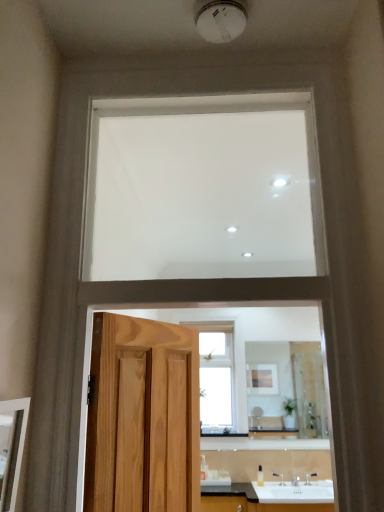
The height and width of the screenshot is (512, 384). Find the location of `clear glass window at center, acting as the second window starting from the front`. clear glass window at center, acting as the second window starting from the front is located at coordinates (216, 375).

Describe the element at coordinates (286, 388) in the screenshot. I see `clear glass mirror at center, which is counted as the 2th mirror, starting from the front` at that location.

Describe the element at coordinates (11, 448) in the screenshot. This screenshot has width=384, height=512. I see `matte wooden mirror at left, placed as the 2th mirror when sorted from bottom to top` at that location.

This screenshot has width=384, height=512. What do you see at coordinates (295, 492) in the screenshot?
I see `white glossy sink at lower center` at bounding box center [295, 492].

At what (x,y) coordinates should I click in order to perform the action: click on clear glass window at center, positioned as the 1th window in back-to-front order. Please return your answer as a coordinate pair (x, y). Image resolution: width=384 pixels, height=512 pixels. Looking at the image, I should click on (216, 375).

From a real-world perspective, is white glossy sink at lower center physically located above or below matte wooden mirror at left, which is the first mirror in top-to-bottom order?

Clearly, from a real-world perspective, white glossy sink at lower center is below matte wooden mirror at left, which is the first mirror in top-to-bottom order.

Is white glossy sink at lower center oriented away from matte wooden mirror at left, which is the first mirror in top-to-bottom order?

No, matte wooden mirror at left, which is the first mirror in top-to-bottom order, is not at the back of white glossy sink at lower center.

Would you say white glossy sink at lower center is inside or outside matte wooden mirror at left, placed as the 2th mirror when sorted from bottom to top?

white glossy sink at lower center lies outside matte wooden mirror at left, placed as the 2th mirror when sorted from bottom to top.

How far apart are white glossy sink at lower center and matte wooden mirror at left, the first mirror from the front?

2.89 meters.

Between clear glass window at center, arranged as the 2th window when viewed from the top, and clear glass mirror at center, the 2th mirror viewed from the left, which one has less height?

With less height is clear glass mirror at center, the 2th mirror viewed from the left.

Is there a large distance between clear glass window at center, positioned as the 1th window in back-to-front order, and clear glass mirror at center, which is counted as the 2th mirror, starting from the front?

clear glass window at center, positioned as the 1th window in back-to-front order, is actually quite close to clear glass mirror at center, which is counted as the 2th mirror, starting from the front.

In the scene shown: Is clear glass window at center, positioned as the 1th window in back-to-front order, surrounding clear glass mirror at center, the 2th mirror viewed from the left?

No, clear glass mirror at center, the 2th mirror viewed from the left, is located outside of clear glass window at center, positioned as the 1th window in back-to-front order.

Can you confirm if matte wooden mirror at left, the 2th mirror in the back-to-front sequence, is shorter than clear glass window at center, arranged as the 2th window when viewed from the top?

Yes.

From a real-world perspective, who is located higher, matte wooden mirror at left, which is the 1th mirror in left-to-right order, or clear glass window at center, arranged as the 2th window when viewed from the top?

clear glass window at center, arranged as the 2th window when viewed from the top, from a real-world perspective.

The height and width of the screenshot is (512, 384). In order to click on mirror in front of the clear glass window at center, positioned as the 1th window in back-to-front order in this screenshot , I will do `click(11, 448)`.

In the scene shown: Is matte wooden mirror at left, the 2th mirror in the back-to-front sequence, smaller than clear glass window at center, arranged as the 2th window when viewed from the top?

Indeed, matte wooden mirror at left, the 2th mirror in the back-to-front sequence, has a smaller size compared to clear glass window at center, arranged as the 2th window when viewed from the top.

Is matte wooden mirror at left, the first mirror from the front, located outside white glossy sink at lower center?

Yes, matte wooden mirror at left, the first mirror from the front, is not within white glossy sink at lower center.

In order to click on mirror that is on the left side of white glossy sink at lower center in this screenshot , I will do `click(11, 448)`.

Which of these two, matte wooden mirror at left, which is the 1th mirror in left-to-right order, or white glossy sink at lower center, stands shorter?

white glossy sink at lower center is shorter.

What's the angular difference between matte wooden mirror at left, the 2th mirror in the back-to-front sequence, and white glossy sink at lower center's facing directions?

They differ by 88.6 degrees in their facing directions.

Considering the positions of objects clear glass window at center, acting as the second window starting from the front, and matte wooden mirror at left, placed as the 2th mirror when sorted from bottom to top, in the image provided, who is more to the left, clear glass window at center, acting as the second window starting from the front, or matte wooden mirror at left, placed as the 2th mirror when sorted from bottom to top,?

Positioned to the left is matte wooden mirror at left, placed as the 2th mirror when sorted from bottom to top.

Is clear glass window at center, arranged as the 2th window when viewed from the top, bigger than matte wooden mirror at left, which is the 1th mirror in left-to-right order?

Yes.

From a real-world perspective, who is located lower, clear glass window at center, positioned as the 1th window in back-to-front order, or matte wooden mirror at left, which is the 1th mirror in left-to-right order?

matte wooden mirror at left, which is the 1th mirror in left-to-right order.

Looking at this image, considering the positions of objects white matte window at upper center, which ranks as the second window in back-to-front order, and clear glass window at center, arranged as the 2th window when viewed from the top, in the image provided, who is behind, white matte window at upper center, which ranks as the second window in back-to-front order, or clear glass window at center, arranged as the 2th window when viewed from the top,?

clear glass window at center, arranged as the 2th window when viewed from the top, is more distant.

Is point (205, 178) positioned behind point (226, 347)?

No.

Would you say white matte window at upper center, which ranks as the second window in back-to-front order, is inside or outside clear glass window at center, acting as the second window starting from the front?

white matte window at upper center, which ranks as the second window in back-to-front order, is not inside clear glass window at center, acting as the second window starting from the front, it's outside.

Is clear glass window at center, acting as the second window starting from the front, outside of white glossy sink at lower center?

That's correct, clear glass window at center, acting as the second window starting from the front, is outside of white glossy sink at lower center.

Measure the distance from clear glass window at center, arranged as the 2th window when viewed from the top, to white glossy sink at lower center.

clear glass window at center, arranged as the 2th window when viewed from the top, and white glossy sink at lower center are 33.57 inches apart from each other.

Is point (210, 411) less distant than point (315, 494)?

No, it is behind (315, 494).

The image size is (384, 512). I want to click on mirror on the left side of white glossy sink at lower center, so click(x=11, y=448).

Identify the location of mirror lying on the right of clear glass window at center, positioned as the 1th window in back-to-front order. The height and width of the screenshot is (512, 384). (286, 388).

Estimate the real-world distances between objects in this image. Which object is further from matte wooden mirror at left, marked as the second mirror in a right-to-left arrangement, clear glass window at center, arranged as the 2th window when viewed from the top, or white matte window at upper center, the first window in the top-to-bottom sequence?

Among the two, clear glass window at center, arranged as the 2th window when viewed from the top, is located further to matte wooden mirror at left, marked as the second mirror in a right-to-left arrangement.

Based on their spatial positions, is matte wooden mirror at left, which is the 1th mirror in left-to-right order, or white glossy sink at lower center closer to clear glass window at center, arranged as the 2th window when viewed from the top?

Based on the image, white glossy sink at lower center appears to be nearer to clear glass window at center, arranged as the 2th window when viewed from the top.

Which object lies further to the anchor point matte wooden mirror at left, the first mirror from the front, white matte window at upper center, the first window in the top-to-bottom sequence, or clear glass window at center, arranged as the 2th window when viewed from the top?

clear glass window at center, arranged as the 2th window when viewed from the top, is positioned further to the anchor matte wooden mirror at left, the first mirror from the front.

From the image, which object appears to be nearer to white glossy sink at lower center, white matte window at upper center, the first window in the top-to-bottom sequence, or clear glass window at center, the 1th window ordered from the bottom?

clear glass window at center, the 1th window ordered from the bottom, is closer to white glossy sink at lower center.

Looking at the image, which one is located further to clear glass window at center, positioned as the 1th window in back-to-front order, matte wooden mirror at left, the 2th mirror in the back-to-front sequence, or white matte window at upper center, which ranks as the second window in back-to-front order?

The object further to clear glass window at center, positioned as the 1th window in back-to-front order, is matte wooden mirror at left, the 2th mirror in the back-to-front sequence.

From the image, which object appears to be farther from matte wooden mirror at left, the first mirror from the front, clear glass mirror at center, the 2th mirror positioned from the top, or white glossy sink at lower center?

Based on the image, clear glass mirror at center, the 2th mirror positioned from the top, appears to be further to matte wooden mirror at left, the first mirror from the front.

Considering their positions, is clear glass mirror at center, which is the first mirror from right to left, positioned closer to matte wooden mirror at left, placed as the 2th mirror when sorted from bottom to top, than clear glass window at center, the 1th window ordered from the bottom?

clear glass window at center, the 1th window ordered from the bottom.

Estimate the real-world distances between objects in this image. Which object is closer to white glossy sink at lower center, clear glass mirror at center, which is the first mirror from right to left, or white matte window at upper center, which ranks as the second window in back-to-front order?

Among the two, clear glass mirror at center, which is the first mirror from right to left, is located nearer to white glossy sink at lower center.

Locate an element on the screen. The width and height of the screenshot is (384, 512). window between white matte window at upper center, the 1th window from the front, and clear glass mirror at center, which is counted as the 1th mirror, starting from the bottom, from front to back is located at coordinates (216, 375).

You are a GUI agent. You are given a task and a screenshot of the screen. Output one action in this format:
    pyautogui.click(x=<x>, y=<y>)
    Task: Click on the mirror between clear glass window at center, acting as the second window starting from the front, and white glossy sink at lower center in the up-down direction
    
    Given the screenshot: What is the action you would take?
    pyautogui.click(x=286, y=388)

I want to click on window between matte wooden mirror at left, which is the 1th mirror in left-to-right order, and white glossy sink at lower center, along the z-axis, so click(x=203, y=188).

Find the location of a particular element. sink between white matte window at upper center, which ranks as the second window in back-to-front order, and clear glass window at center, positioned as the 1th window in back-to-front order, from front to back is located at coordinates (295, 492).